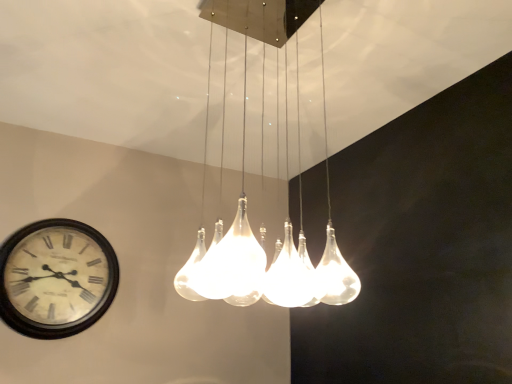
Question: From the image's perspective, is translucent glass chandelier at center on top of white glossy clock at lower left?

Choices:
 (A) no
 (B) yes

Answer: (B)

Question: Is translucent glass chandelier at center far from white glossy clock at lower left?

Choices:
 (A) no
 (B) yes

Answer: (A)

Question: Could you tell me if translucent glass chandelier at center is facing white glossy clock at lower left?

Choices:
 (A) no
 (B) yes

Answer: (A)

Question: Considering the relative sizes of translucent glass chandelier at center and white glossy clock at lower left in the image provided, is translucent glass chandelier at center taller than white glossy clock at lower left?

Choices:
 (A) no
 (B) yes

Answer: (B)

Question: Is translucent glass chandelier at center thinner than white glossy clock at lower left?

Choices:
 (A) yes
 (B) no

Answer: (B)

Question: Considering the relative sizes of translucent glass chandelier at center and white glossy clock at lower left in the image provided, is translucent glass chandelier at center bigger than white glossy clock at lower left?

Choices:
 (A) yes
 (B) no

Answer: (A)

Question: From the image's perspective, does white glossy clock at lower left appear higher than translucent glass chandelier at center?

Choices:
 (A) no
 (B) yes

Answer: (A)

Question: Considering the relative sizes of white glossy clock at lower left and translucent glass chandelier at center in the image provided, is white glossy clock at lower left taller than translucent glass chandelier at center?

Choices:
 (A) no
 (B) yes

Answer: (A)

Question: Does white glossy clock at lower left have a lesser height compared to translucent glass chandelier at center?

Choices:
 (A) no
 (B) yes

Answer: (B)

Question: Considering the relative positions of white glossy clock at lower left and translucent glass chandelier at center in the image provided, is white glossy clock at lower left to the right of translucent glass chandelier at center from the viewer's perspective?

Choices:
 (A) no
 (B) yes

Answer: (A)

Question: Is white glossy clock at lower left facing away from translucent glass chandelier at center?

Choices:
 (A) no
 (B) yes

Answer: (A)

Question: Does white glossy clock at lower left touch translucent glass chandelier at center?

Choices:
 (A) yes
 (B) no

Answer: (B)

Question: Considering the relative positions of white glossy clock at lower left and translucent glass chandelier at center in the image provided, is white glossy clock at lower left to the left or to the right of translucent glass chandelier at center?

Choices:
 (A) left
 (B) right

Answer: (A)